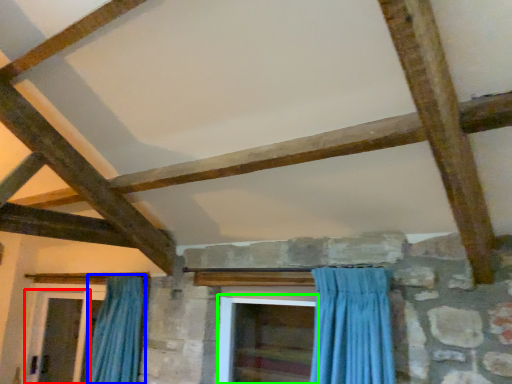
Question: Considering the real-world distances, which object is closest to screen door (highlighted by a red box)? curtain (highlighted by a blue box) or screen door (highlighted by a green box).

Choices:
 (A) curtain
 (B) screen door

Answer: (A)